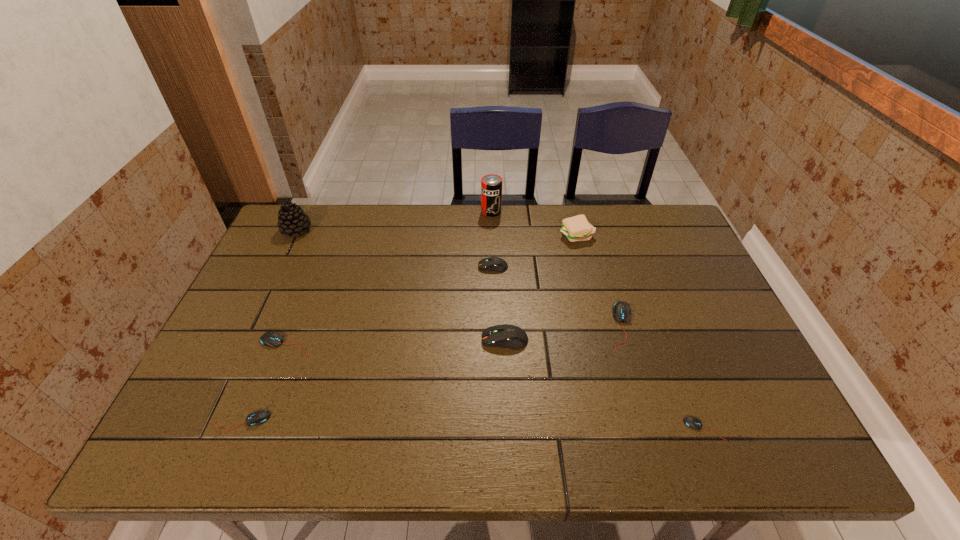
What are the coordinates of `vacant space that is in between the nearer dark computer equipment and the farthest object` in the screenshot? It's located at (498, 276).

At what (x,y) coordinates should I click in order to perform the action: click on vacant space that is in between the second tallest mouse and the nearer dark computer equipment. Please return your answer as a coordinate pair (x, y). Looking at the image, I should click on (499, 303).

Identify the location of free area in between the can and the biggest black mouse. Image resolution: width=960 pixels, height=540 pixels. (557, 269).

At what (x,y) coordinates should I click in order to perform the action: click on object that is the eighth closest to the fifth tallest mouse. Please return your answer as a coordinate pair (x, y). This screenshot has width=960, height=540. Looking at the image, I should click on (577, 228).

Identify which object is the nearest to the tallest mouse. Please provide its 2D coordinates. Your answer should be formatted as a tuple, i.e. [(x, y)], where the tuple contains the x and y coordinates of a point satisfying the conditions above.

[(621, 311)]

Select which mouse is the second closest to the seventh tallest object. Please provide its 2D coordinates. Your answer should be formatted as a tuple, i.e. [(x, y)], where the tuple contains the x and y coordinates of a point satisfying the conditions above.

[(513, 337)]

Select which mouse appears as the fourth closest to the patty. Please provide its 2D coordinates. Your answer should be formatted as a tuple, i.e. [(x, y)], where the tuple contains the x and y coordinates of a point satisfying the conditions above.

[(691, 422)]

Identify which black mouse is located as the third nearest to the eighth shortest object. Please provide its 2D coordinates. Your answer should be formatted as a tuple, i.e. [(x, y)], where the tuple contains the x and y coordinates of a point satisfying the conditions above.

[(621, 311)]

Locate which black mouse is the closest to the second shortest mouse. Please provide its 2D coordinates. Your answer should be formatted as a tuple, i.e. [(x, y)], where the tuple contains the x and y coordinates of a point satisfying the conditions above.

[(272, 339)]

You are a GUI agent. You are given a task and a screenshot of the screen. Output one action in this format:
    pyautogui.click(x=<x>, y=<y>)
    Task: Click on the free spot that satisfies the following two spatial constraints: 1. on the button of the smallest black mouse; 2. on the right side of the smaller dark computer equipment
    The height and width of the screenshot is (540, 960).
    Given the screenshot: What is the action you would take?
    pyautogui.click(x=498, y=429)